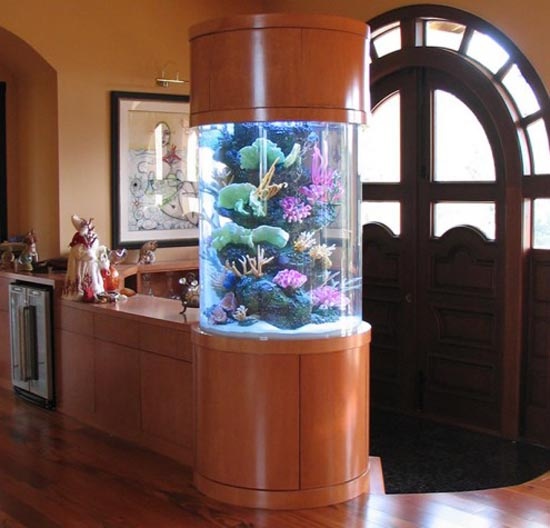
The image size is (550, 528). Find the location of `shelf`. shelf is located at coordinates (178, 292).